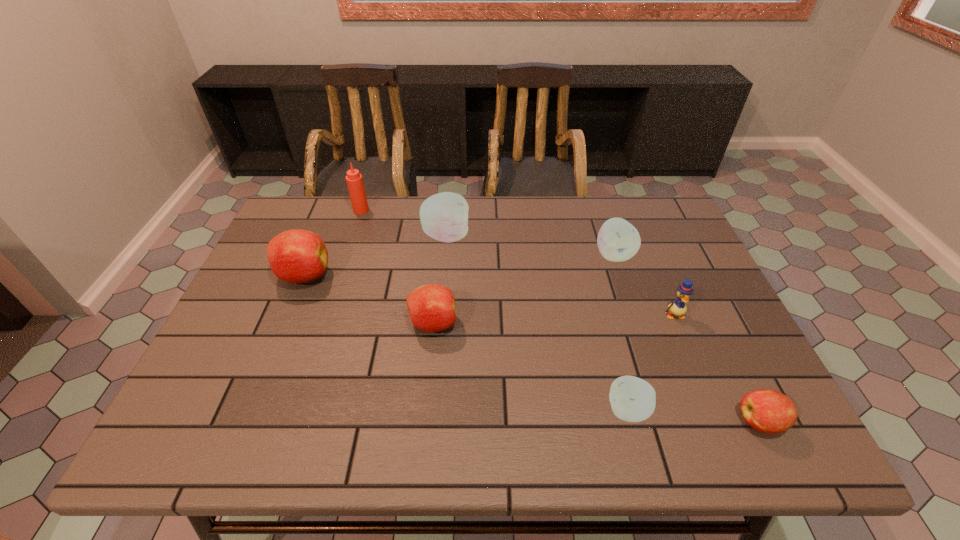
The width and height of the screenshot is (960, 540). What are the coordinates of `object that can be found as the second closest to the yellow duckling` in the screenshot? It's located at (768, 411).

Select which object appears as the sixth closest to the second smallest red apple. Please provide its 2D coordinates. Your answer should be formatted as a tuple, i.e. [(x, y)], where the tuple contains the x and y coordinates of a point satisfying the conditions above.

[(678, 307)]

Find the location of a particular element. This screenshot has height=540, width=960. apple that is the closest to the biggest white apple is located at coordinates (432, 308).

Identify which apple is the fifth nearest to the leftmost white apple. Please provide its 2D coordinates. Your answer should be formatted as a tuple, i.e. [(x, y)], where the tuple contains the x and y coordinates of a point satisfying the conditions above.

[(768, 411)]

You are a GUI agent. You are given a task and a screenshot of the screen. Output one action in this format:
    pyautogui.click(x=<x>, y=<y>)
    Task: Click on the white apple that is the second closest to the biggest white apple
    This screenshot has width=960, height=540.
    Given the screenshot: What is the action you would take?
    pyautogui.click(x=632, y=399)

This screenshot has height=540, width=960. I want to click on the second closest white apple to the smallest white apple, so click(x=444, y=216).

Locate an element on the screen. The width and height of the screenshot is (960, 540). the second closest red apple to the Tabasco sauce is located at coordinates (432, 308).

Locate which red apple is the second closest to the farthest red apple. Please provide its 2D coordinates. Your answer should be formatted as a tuple, i.e. [(x, y)], where the tuple contains the x and y coordinates of a point satisfying the conditions above.

[(768, 411)]

Image resolution: width=960 pixels, height=540 pixels. Find the location of `vacant space that satisfies the following two spatial constraints: 1. on the front side of the nearest white apple; 2. on the left side of the leftmost white apple`. vacant space that satisfies the following two spatial constraints: 1. on the front side of the nearest white apple; 2. on the left side of the leftmost white apple is located at coordinates (431, 410).

In order to click on free space that satisfies the following two spatial constraints: 1. on the face of the yellow duckling, where the monocle is placed; 2. on the right side of the smallest red apple in this screenshot , I will do pos(718,422).